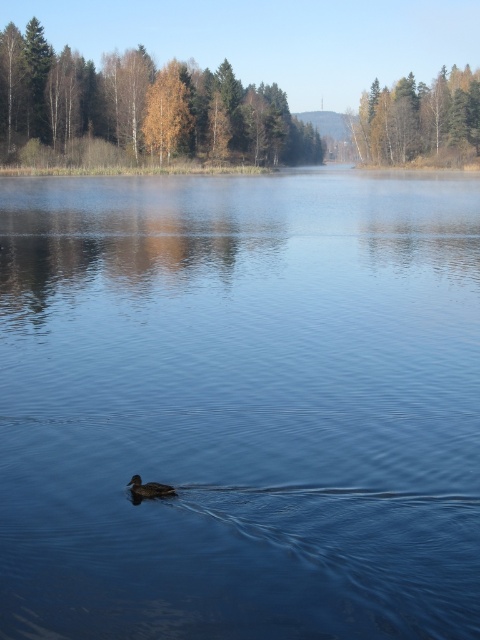
Based on the photo, who is positioned more to the left, transparent blue water at center or brown matte duck at center?

Positioned to the left is brown matte duck at center.

Does transparent blue water at center have a smaller size compared to brown matte duck at center?

No.

Which is behind, point (100, 342) or point (139, 502)?

Positioned behind is point (100, 342).

The height and width of the screenshot is (640, 480). Identify the location of transparent blue water at center. (240, 406).